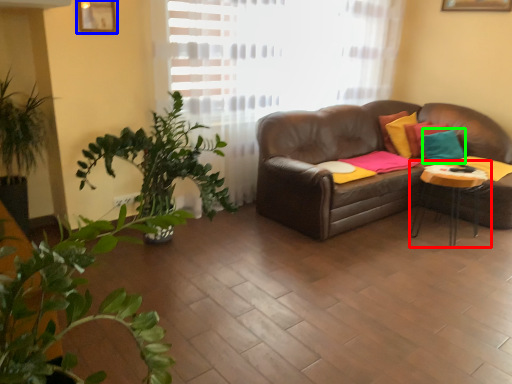
Question: Considering the real-world distances, which object is farthest from table (highlighted by a red box)? picture frame (highlighted by a blue box) or pillow (highlighted by a green box)?

Choices:
 (A) picture frame
 (B) pillow

Answer: (A)